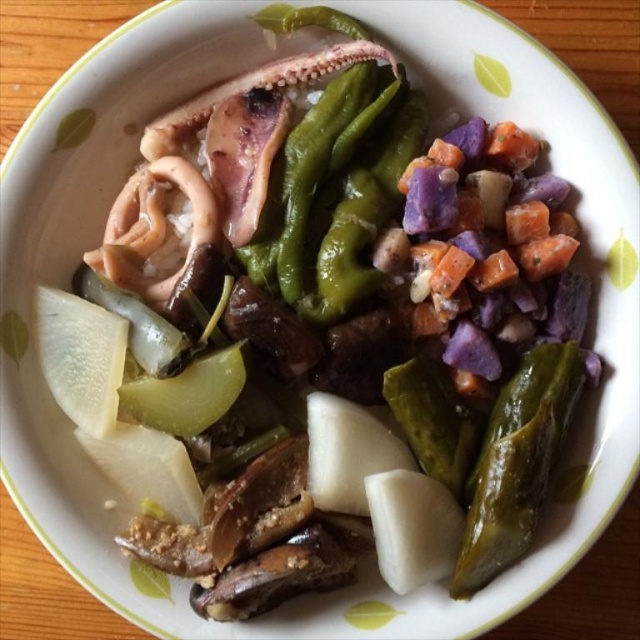
Can you confirm if green glossy pepper at lower right is positioned to the left of orange matte carrot at center-right?

In fact, green glossy pepper at lower right is to the right of orange matte carrot at center-right.

Who is lower down, green glossy pepper at lower right or orange matte carrot at center-right?

Positioned lower is green glossy pepper at lower right.

Is point (477, 492) farther from camera compared to point (438, 272)?

No, (477, 492) is closer to viewer.

This screenshot has height=640, width=640. I want to click on green glossy pepper at lower right, so click(516, 461).